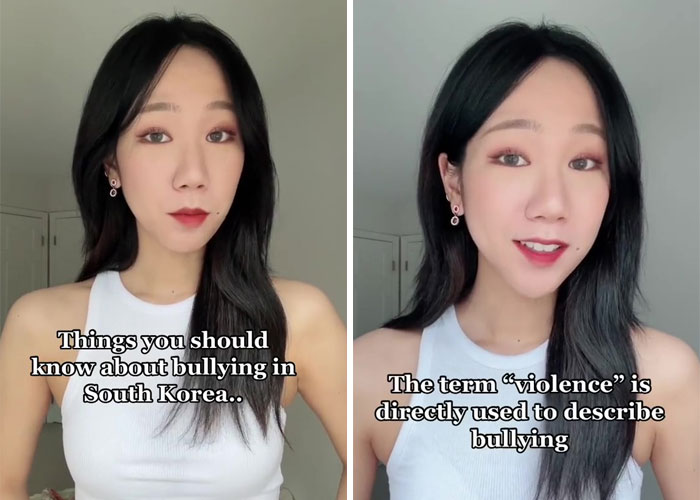
I want to click on hinges, so click(x=392, y=267), click(x=407, y=262), click(x=41, y=240), click(x=54, y=239).